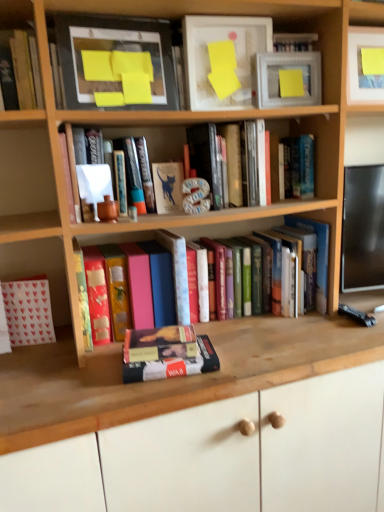
Identify the location of unoccupied area behind matte white picture frame at upper right, positioned as the 2th picture frame in left-to-right order. (289, 118).